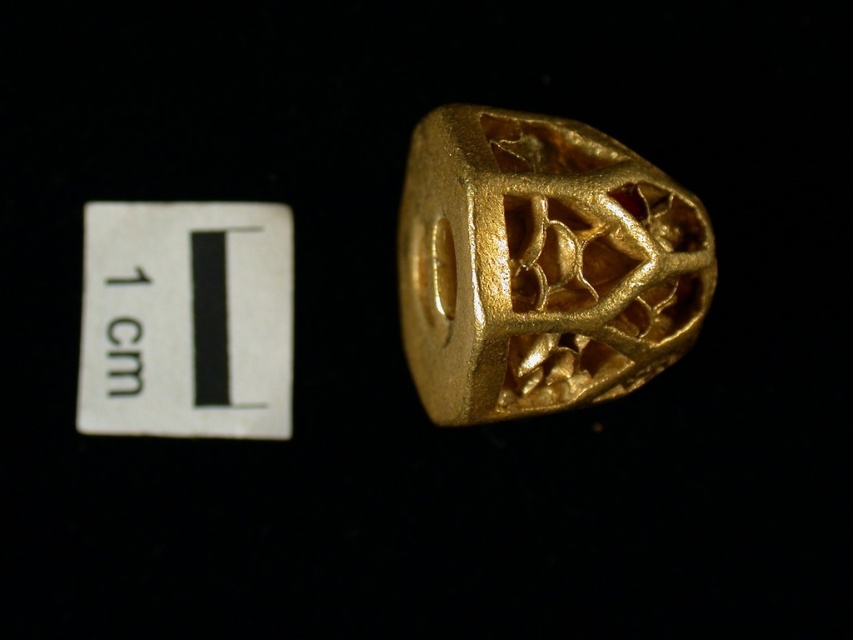
You are an appraiser examining a gold matte ring at center and a white paper at upper left. Which object is significantly larger in height?

The gold matte ring at center is much taller than the white paper at upper left.

You are an appraiser examining a gold matte ring at center and a white paper at upper left. The client asks if the ring can fit into a storage box designed for items smaller than the paper. Based on their sizes, what should you tell them?

The gold matte ring at center is wider than the white paper at upper left, so it cannot fit into the storage box designed for items smaller than the paper.

You are examining the golden object and notice two points marked on it. From your perspective, which point is closer to you, point (x=490, y=400) or point (x=157, y=298)?

Point (x=490, y=400) is closer to the viewer than point (x=157, y=298).